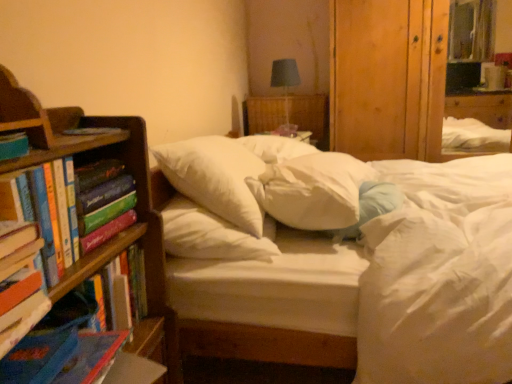
Question: Is point (202, 172) closer or farther from the camera than point (69, 140)?

Choices:
 (A) closer
 (B) farther

Answer: (B)

Question: From their relative heights in the image, would you say white soft pillow at center, the first pillow in the left-to-right sequence, is taller or shorter than wooden bookshelf at left?

Choices:
 (A) short
 (B) tall

Answer: (A)

Question: Which object is the closest to the white soft pillow at center, which is the third pillow from right to left?

Choices:
 (A) white soft pillow at center, acting as the first pillow starting from the right
 (B) white soft pillow at center, the second pillow positioned from the right
 (C) hardcover book at left, marked as the 4th book in a front-to-back arrangement
 (D) wooden table at center
 (E) matte gray lampshade at upper center

Answer: (B)

Question: Which of these objects is positioned farthest from the white soft pillow at center, the first pillow in the left-to-right sequence?

Choices:
 (A) wooden table at center
 (B) wooden bookshelf at left
 (C) hardcover book at left, positioned as the first book in front-to-back order
 (D) hardcover book at left, which is the 3th book from front to back
 (E) matte gray lampshade at upper center

Answer: (A)